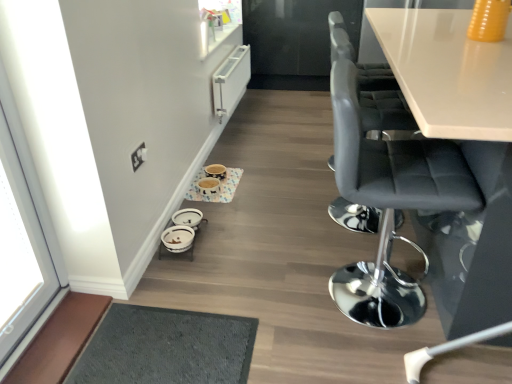
Question: Considering the positions of black leather stool at right, placed as the first chair when sorted from front to back, and white glass window at left in the image, is black leather stool at right, placed as the first chair when sorted from front to back, taller or shorter than white glass window at left?

Choices:
 (A) tall
 (B) short

Answer: (B)

Question: Based on their positions, is black leather stool at right, placed as the first chair when sorted from front to back, located to the left or right of white glass window at left?

Choices:
 (A) right
 (B) left

Answer: (A)

Question: Which object is the farthest from the white ceramic bowls at lower center, the first round table when ordered from bottom to top?

Choices:
 (A) black leather stool at right, placed as the first chair when sorted from front to back
 (B) gray fabric chair at right, the 2th chair viewed from the front
 (C) matte ceramic bowls at center, which is the second round table from bottom to top
 (D) white glass window at left

Answer: (B)

Question: Estimate the real-world distances between objects in this image. Which object is closer to the white ceramic bowls at lower center, which is the 2th round table in back-to-front order?

Choices:
 (A) matte ceramic bowls at center, positioned as the 1th round table in top-to-bottom order
 (B) black leather stool at right, the second chair positioned from the back
 (C) white glass window at left
 (D) gray fabric chair at right, the 1th chair when ordered from back to front

Answer: (A)